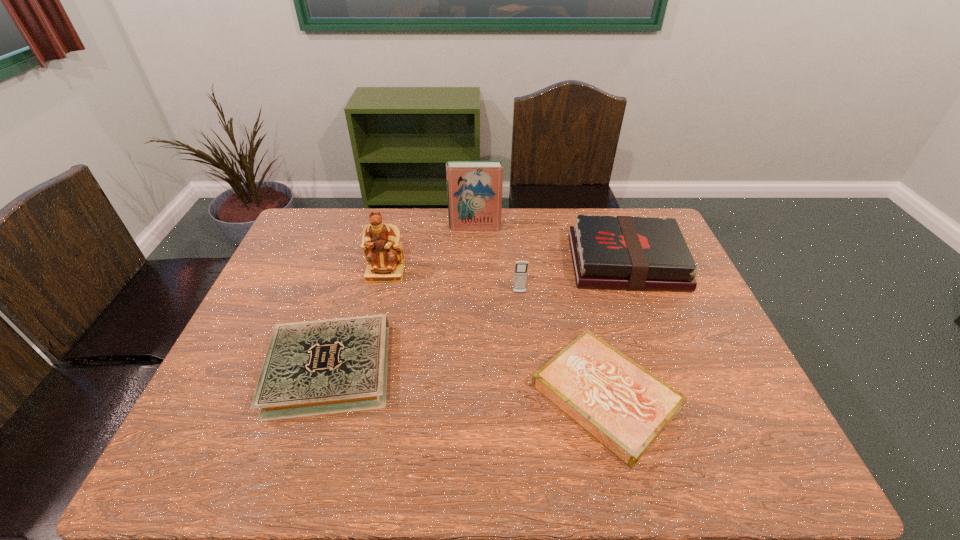
At what (x,y) coordinates should I click in order to perform the action: click on the second hardback book from left to right. Please return your answer as a coordinate pair (x, y). Looking at the image, I should click on (474, 188).

This screenshot has height=540, width=960. I want to click on the third object from left to right, so click(474, 188).

Where is `figurine`? figurine is located at coordinates (381, 243).

I want to click on cellular telephone, so click(521, 267).

Image resolution: width=960 pixels, height=540 pixels. Identify the location of the second tallest hardback book. (630, 253).

In order to click on the second farthest hardback book in this screenshot , I will do `click(630, 253)`.

This screenshot has height=540, width=960. I want to click on the leftmost hardback book, so click(317, 367).

The height and width of the screenshot is (540, 960). What are the coordinates of `the shortest object` in the screenshot? It's located at (625, 407).

Identify the location of vacant space positioned 0.280m on the cover of the second hardback book from left to right. The height and width of the screenshot is (540, 960). (474, 285).

Locate an element on the screen. vacant space situated on the front-facing side of the figurine is located at coordinates click(378, 301).